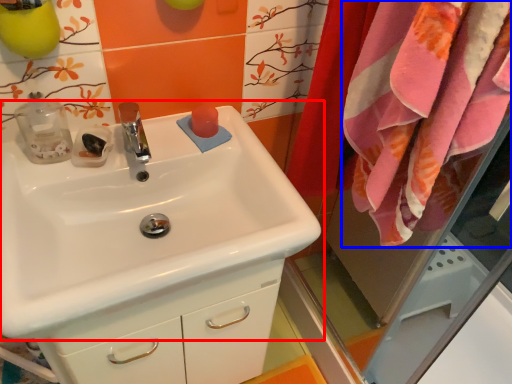
Question: Which point is further to the camera, sink (highlighted by a red box) or bath towel (highlighted by a blue box)?

Choices:
 (A) sink
 (B) bath towel

Answer: (A)